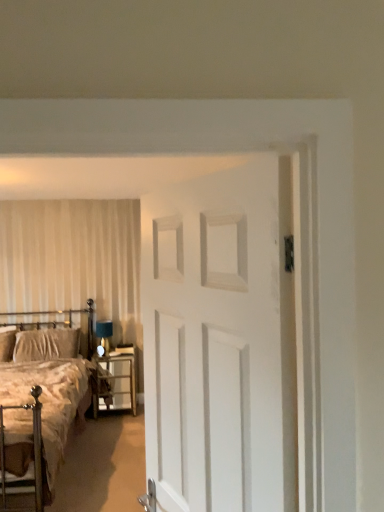
Question: From their relative heights in the image, would you say velvet beige pillow at left is taller or shorter than metallic silver headboard at left?

Choices:
 (A) short
 (B) tall

Answer: (A)

Question: Based on their sizes in the image, would you say velvet beige pillow at left is bigger or smaller than metallic silver headboard at left?

Choices:
 (A) big
 (B) small

Answer: (B)

Question: Which is farther from the metallic silver headboard at left?

Choices:
 (A) metallic silver nightstand at lower center
 (B) metallic gold bed at left
 (C) velvet beige pillow at left
 (D) white matte door at center

Answer: (D)

Question: Which object is positioned farthest from the white matte door at center?

Choices:
 (A) metallic gold bed at left
 (B) metallic silver headboard at left
 (C) metallic silver nightstand at lower center
 (D) velvet beige pillow at left

Answer: (B)